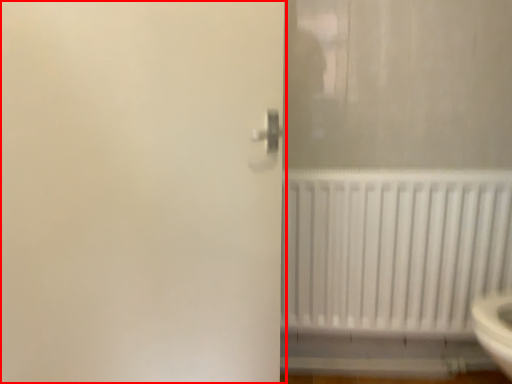
Question: From the image's perspective, where is screen door (annotated by the red box) located relative to radiator?

Choices:
 (A) above
 (B) below

Answer: (A)